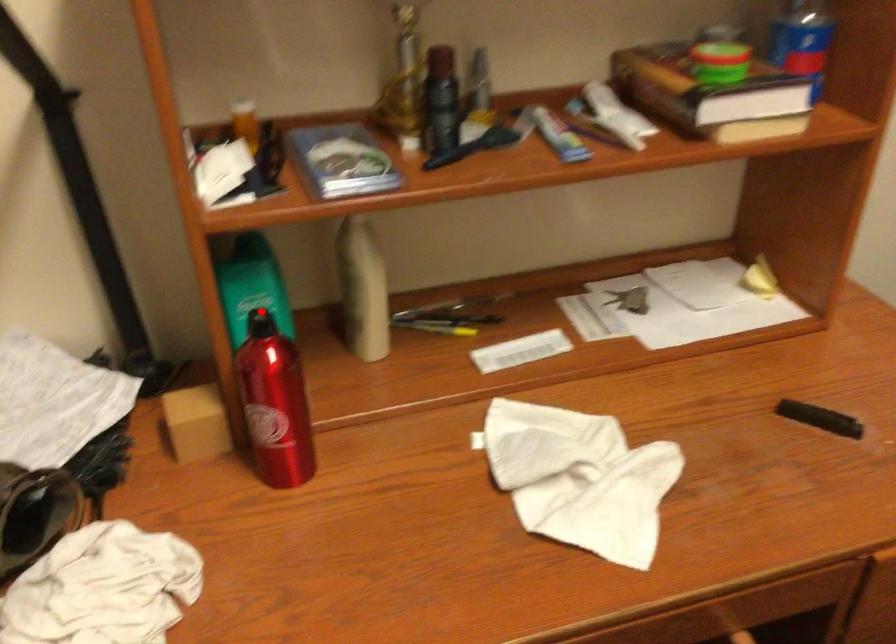
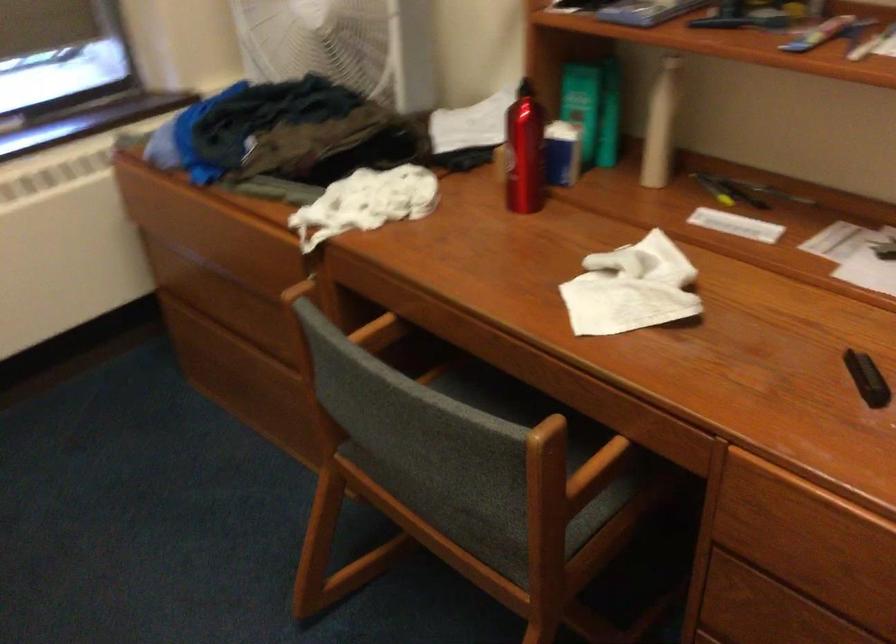
Find the pixel in the second image that matches the highlighted location in the first image.

(582, 104)